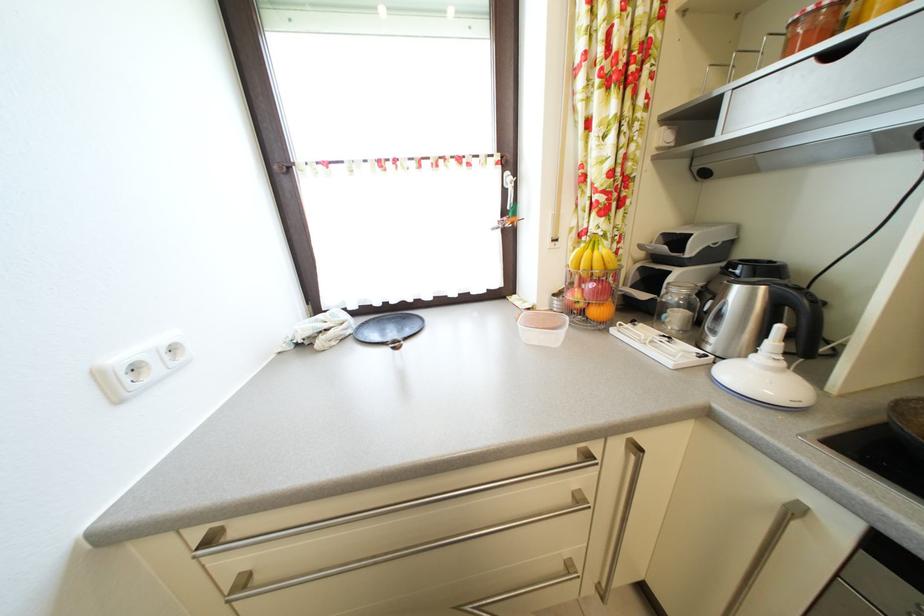
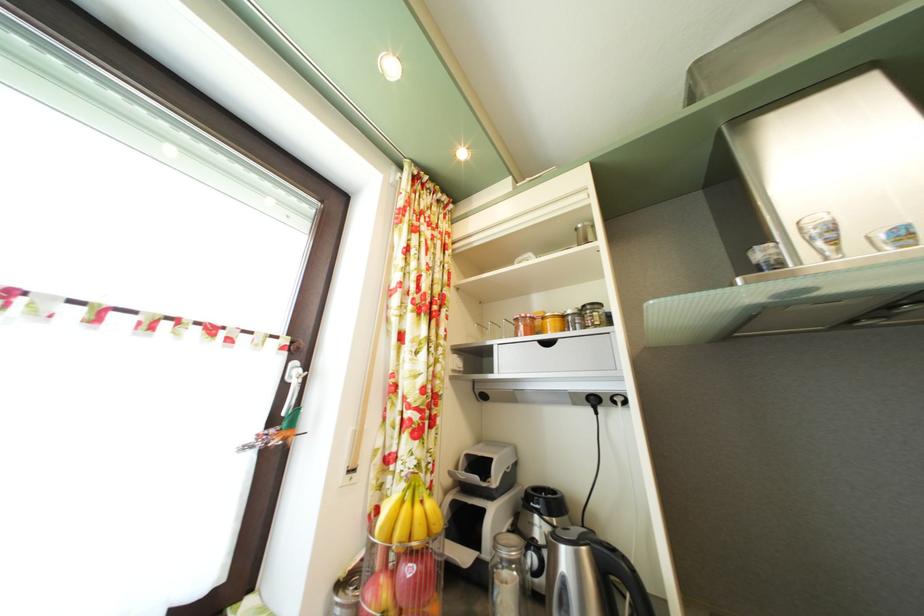
In the second image, find the point that corresponds to pixel 603 261 in the first image.

(426, 516)